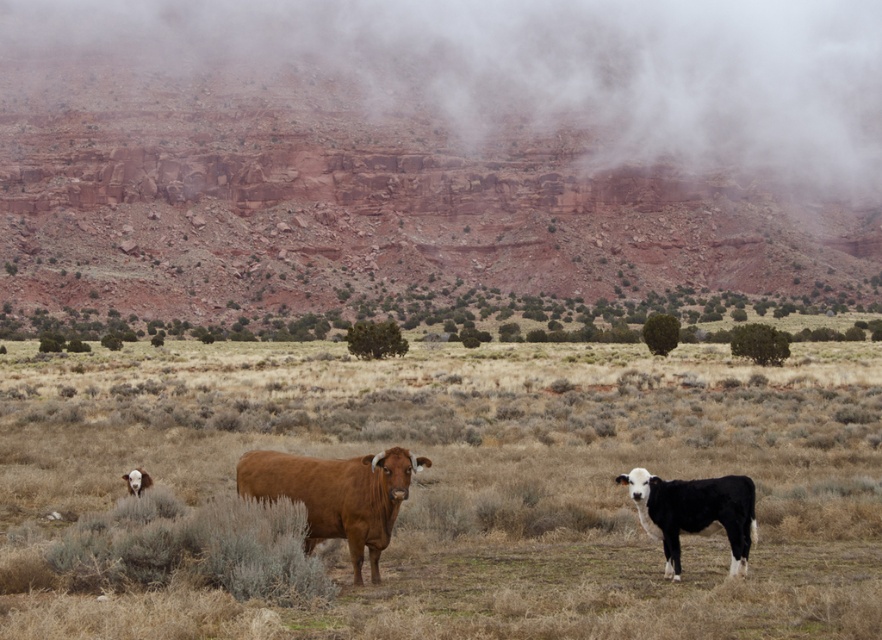
Is brown matte cow at center above brown smooth cow at lower left?

Yes.

Is point (365, 509) behind point (135, 493)?

That is False.

Image resolution: width=882 pixels, height=640 pixels. I want to click on brown matte cow at center, so click(x=335, y=493).

At what (x,y) coordinates should I click in order to perform the action: click on brown matte cow at center. Please return your answer as a coordinate pair (x, y). Image resolution: width=882 pixels, height=640 pixels. Looking at the image, I should click on (335, 493).

Is point (752, 92) less distant than point (731, 506)?

No, it is behind (731, 506).

Is foggy misty cliff at upper center smaller than black smooth calf at lower right?

Actually, foggy misty cliff at upper center might be larger than black smooth calf at lower right.

Find the location of a particular element. Image resolution: width=882 pixels, height=640 pixels. foggy misty cliff at upper center is located at coordinates 509,72.

The width and height of the screenshot is (882, 640). Find the location of `foggy misty cliff at upper center`. foggy misty cliff at upper center is located at coordinates (509, 72).

Is point (132, 568) farther from camera compared to point (779, 177)?

No, it is not.

This screenshot has height=640, width=882. What are the coordinates of `dry grass at center` in the screenshot? It's located at (446, 486).